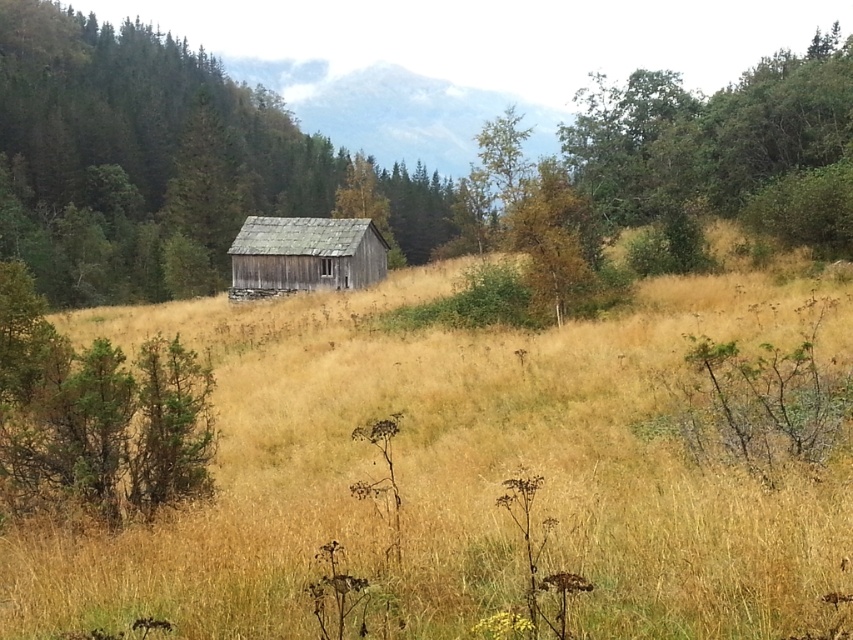
You are standing in the field of golden grass and want to reach the weathered wood hut at center. There is a green textured tree at center blocking your path. Can you walk around the tree to get to the hut?

The weathered wood hut at center is behind the green textured tree at center, so you can walk around the tree to reach the hut.

You are standing in the middle of the field and see the green textured tree at center and the weathered wood hut at center. Which object is bigger?

The green textured tree at center is larger in size compared to the weathered wood hut at center.